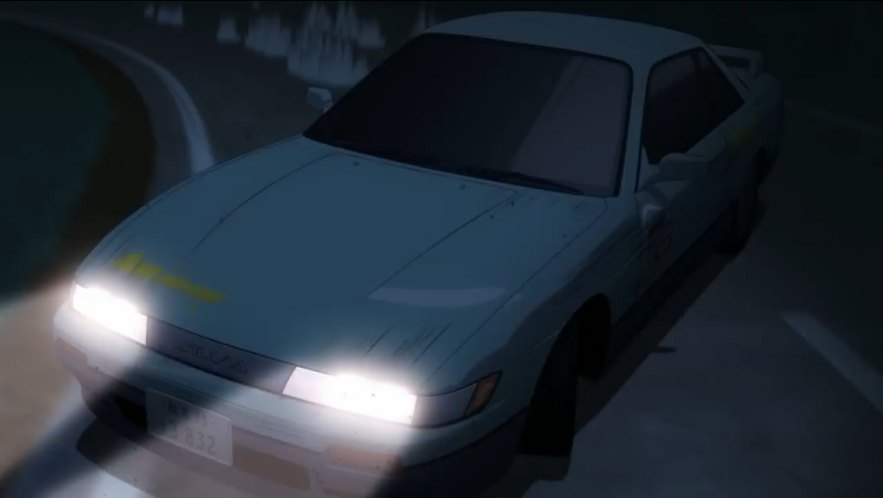
Find the location of a particular element. front mirrors is located at coordinates (683, 165), (318, 93).